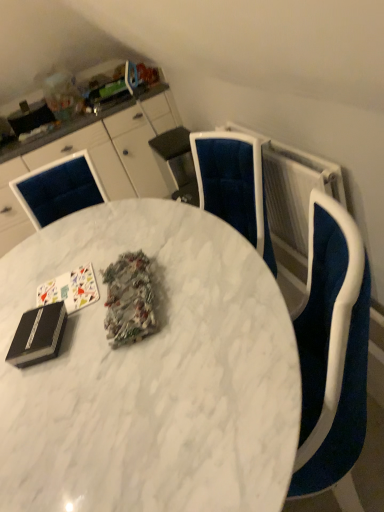
Identify the location of free spot behind black matte binder at lower left. 56,294.